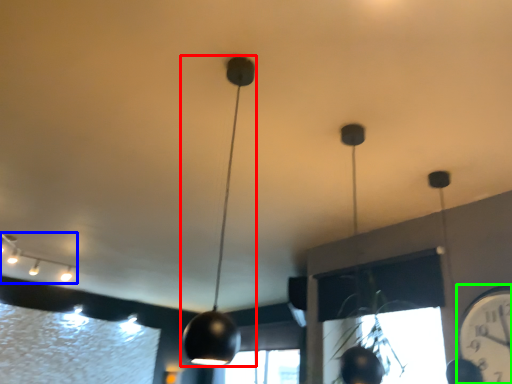
Question: Estimate the real-world distances between objects in this image. Which object is farther from lamp (highlighted by a red box), lamp (highlighted by a blue box) or clock (highlighted by a green box)?

Choices:
 (A) lamp
 (B) clock

Answer: (A)